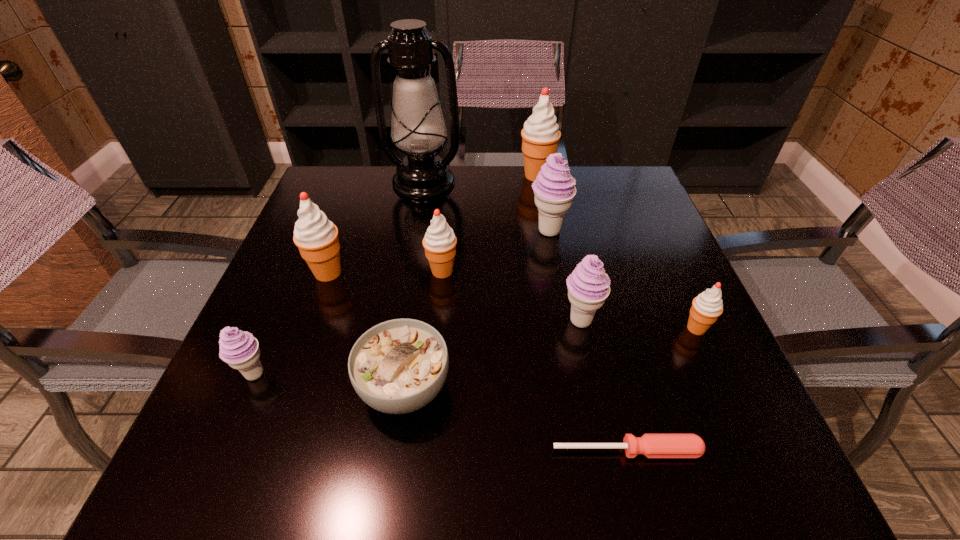
The height and width of the screenshot is (540, 960). Find the location of `black oil lamp`. black oil lamp is located at coordinates (418, 127).

Locate an element on the screen. Image resolution: width=960 pixels, height=540 pixels. the tallest object is located at coordinates (418, 127).

Where is `the biggest red icecream`? the biggest red icecream is located at coordinates (540, 135).

Find the location of a particular element. This screenshot has height=540, width=960. the farthest icecream is located at coordinates (540, 135).

You are a GUI agent. You are given a task and a screenshot of the screen. Output one action in this format:
    pyautogui.click(x=<x>, y=<y>)
    Task: Click on the farthest purple icecream
    The image size is (960, 540).
    Given the screenshot: What is the action you would take?
    pos(554,189)

Identify the location of the eighth nearest object. The width and height of the screenshot is (960, 540). [554, 189].

This screenshot has width=960, height=540. In order to click on the third smallest red icecream in this screenshot , I will do `click(316, 237)`.

Find the location of `the third biggest red icecream`. the third biggest red icecream is located at coordinates click(439, 242).

I want to click on the third red icecream from right to left, so click(x=439, y=242).

Locate an element on the screen. This screenshot has width=960, height=540. the second farthest purple icecream is located at coordinates (588, 286).